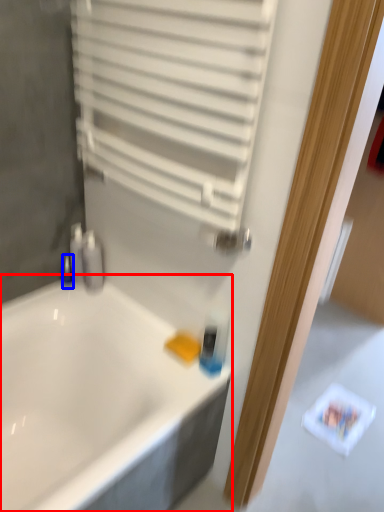
Question: Which of the following is the closest to the observer, bathtub (highlighted by a red box) or toiletry (highlighted by a blue box)?

Choices:
 (A) bathtub
 (B) toiletry

Answer: (A)